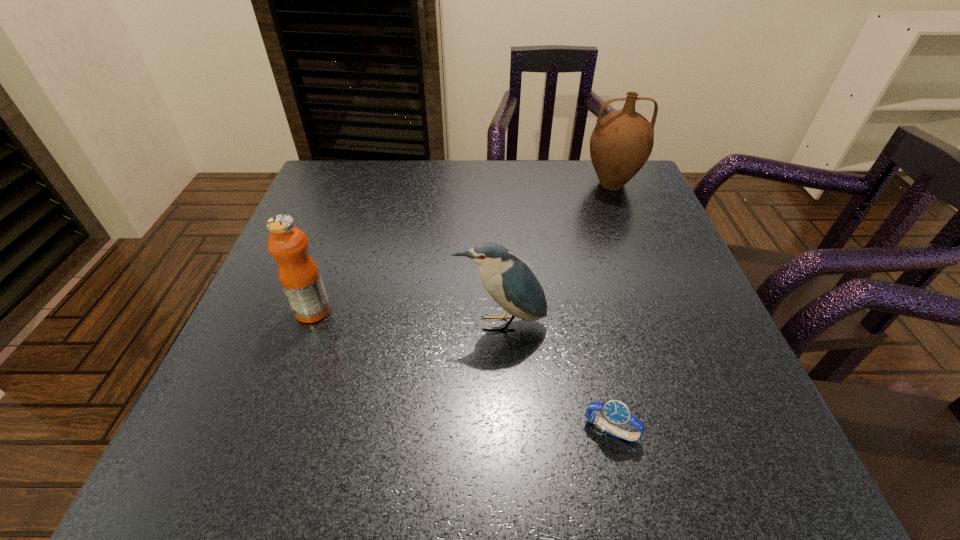
The height and width of the screenshot is (540, 960). What are the coordinates of `unoccupied position between the fruit juice and the shortest object` in the screenshot? It's located at (462, 370).

This screenshot has width=960, height=540. Find the location of `free area in between the rightmost object and the leftmost object`. free area in between the rightmost object and the leftmost object is located at coordinates (462, 247).

This screenshot has height=540, width=960. What are the coordinates of `empty location between the leftmost object and the rightmost object` in the screenshot? It's located at 462,247.

The width and height of the screenshot is (960, 540). Find the location of `unoccupied area between the third object from right to left and the leftmost object`. unoccupied area between the third object from right to left and the leftmost object is located at coordinates (406, 317).

Image resolution: width=960 pixels, height=540 pixels. I want to click on empty space that is in between the third object from right to left and the leftmost object, so click(406, 317).

At what (x,y) coordinates should I click in order to perform the action: click on free space between the third object from left to right and the bird. Please return your answer as a coordinate pair (x, y). The width and height of the screenshot is (960, 540). Looking at the image, I should click on (555, 377).

Locate an element on the screen. This screenshot has width=960, height=540. vacant point located between the nearest object and the third object from right to left is located at coordinates (555, 377).

At what (x,y) coordinates should I click in order to perform the action: click on vacant point located between the rightmost object and the second object from left to right. Please return your answer as a coordinate pair (x, y). Looking at the image, I should click on (556, 254).

The height and width of the screenshot is (540, 960). Find the location of `empty space between the third object from right to left and the leftmost object`. empty space between the third object from right to left and the leftmost object is located at coordinates (406, 317).

Locate an element on the screen. This screenshot has height=540, width=960. free spot between the farthest object and the fruit juice is located at coordinates (462, 247).